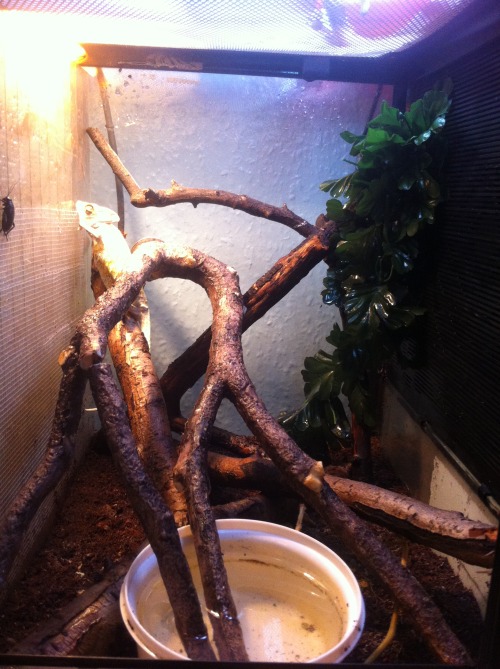
Image resolution: width=500 pixels, height=669 pixels. I want to click on light source, so click(43, 64).